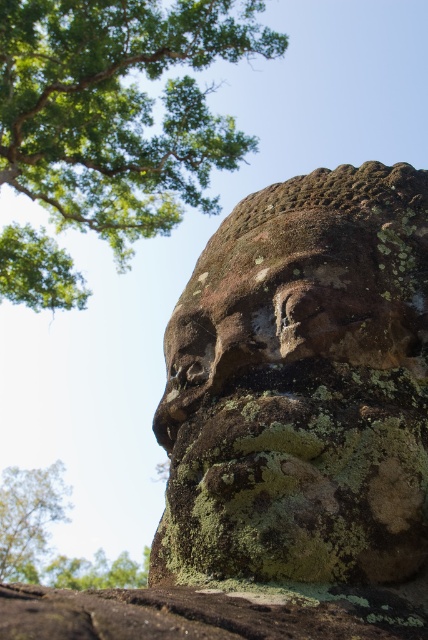
Question: Can you confirm if green mossy rock at upper left is positioned below rusty stone face at center?

Choices:
 (A) yes
 (B) no

Answer: (B)

Question: Does rusty stone face at center appear on the right side of green mossy tree at upper left?

Choices:
 (A) yes
 (B) no

Answer: (A)

Question: Is green mossy rock at upper left above rusty stone face at center?

Choices:
 (A) yes
 (B) no

Answer: (A)

Question: Among these objects, which one is nearest to the camera?

Choices:
 (A) green mossy stone face at center
 (B) green mossy tree at upper left
 (C) green mossy rock at upper left
 (D) rusty stone face at center

Answer: (A)

Question: Which of the following is the closest to the observer?

Choices:
 (A) green mossy tree at upper left
 (B) green mossy stone face at center
 (C) green mossy rock at upper left
 (D) rusty stone face at center

Answer: (B)

Question: Which point is farther to the camera?

Choices:
 (A) [101, 115]
 (B) [372, 378]
 (C) [362, 212]
 (D) [29, 580]

Answer: (D)